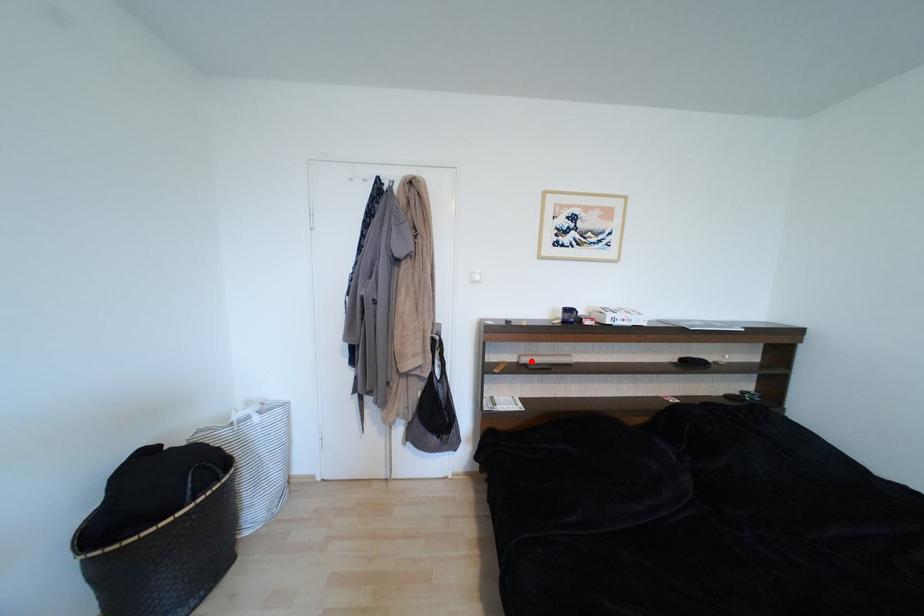
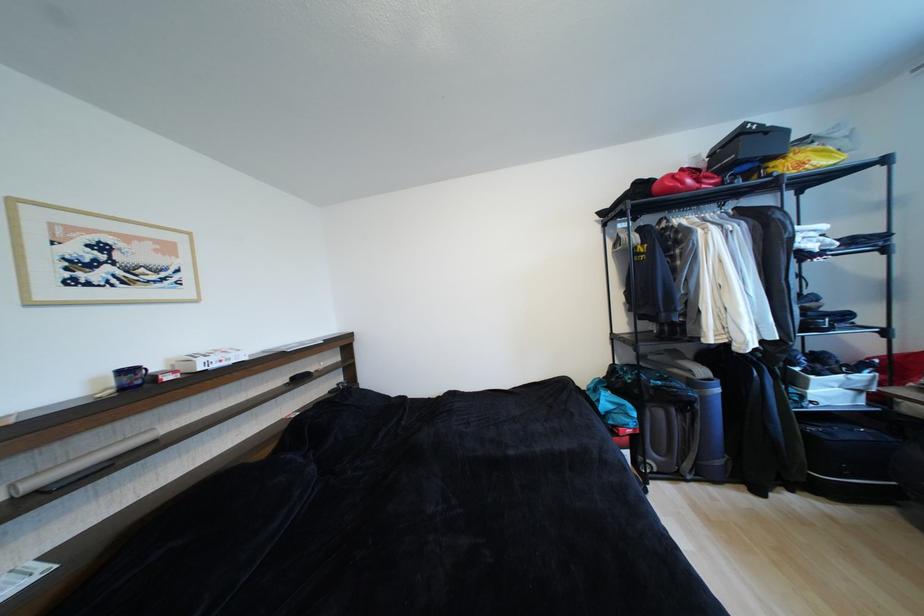
Find the pixel in the second image that matches the highlighted location in the first image.

(40, 485)